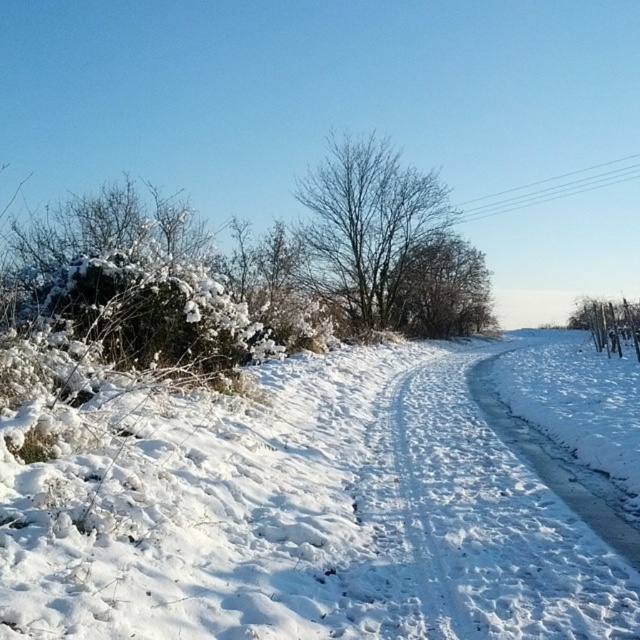
Question: Can you confirm if white snow at center is positioned to the right of bare branches at center?

Choices:
 (A) yes
 (B) no

Answer: (A)

Question: Considering the relative positions of bare branches at center and bare branches at right in the image provided, where is bare branches at center located with respect to bare branches at right?

Choices:
 (A) right
 (B) left

Answer: (B)

Question: Which object appears closest to the camera in this image?

Choices:
 (A) bare branches at center
 (B) white fluffy snow at center
 (C) bare branches at right

Answer: (B)

Question: Which object appears closest to the camera in this image?

Choices:
 (A) white fluffy snow at center
 (B) white snow at center
 (C) bare branches at center

Answer: (A)

Question: Which object appears farthest from the camera in this image?

Choices:
 (A) white fluffy snow at center
 (B) white snow at center
 (C) bare branches at right

Answer: (C)

Question: Considering the relative positions of bare branches at center and bare branches at right in the image provided, where is bare branches at center located with respect to bare branches at right?

Choices:
 (A) below
 (B) above

Answer: (B)